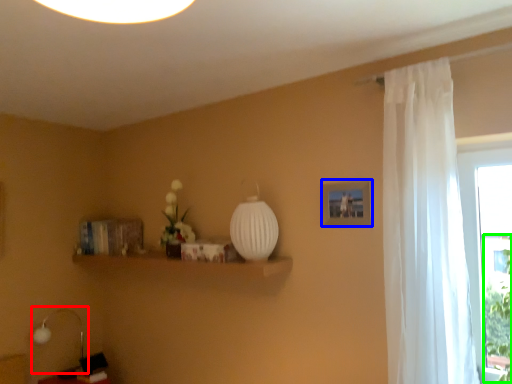
Question: Considering the real-world distances, which object is closest to table lamp (highlighted by a red box)? picture frame (highlighted by a blue box) or plant (highlighted by a green box).

Choices:
 (A) picture frame
 (B) plant

Answer: (A)